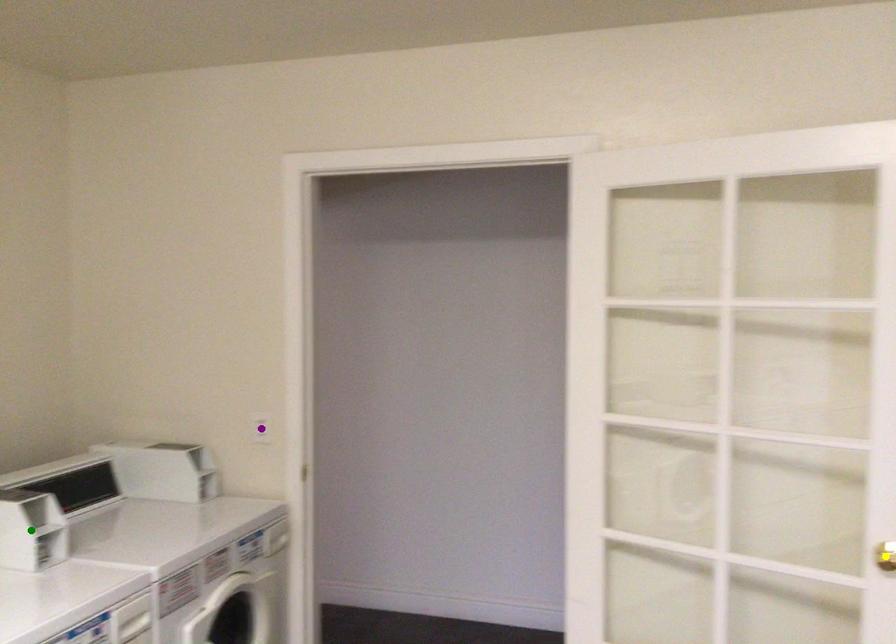
Order these from nearest to farthest:
purple point | green point | yellow point

yellow point, green point, purple point